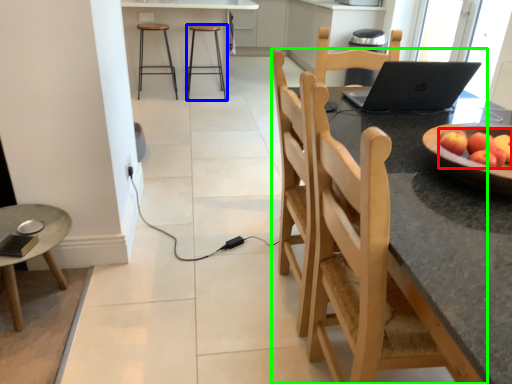
Question: Considering the real-world distances, which object is closest to apple (highlighted by a red box)? stool (highlighted by a blue box) or chair (highlighted by a green box).

Choices:
 (A) stool
 (B) chair

Answer: (B)